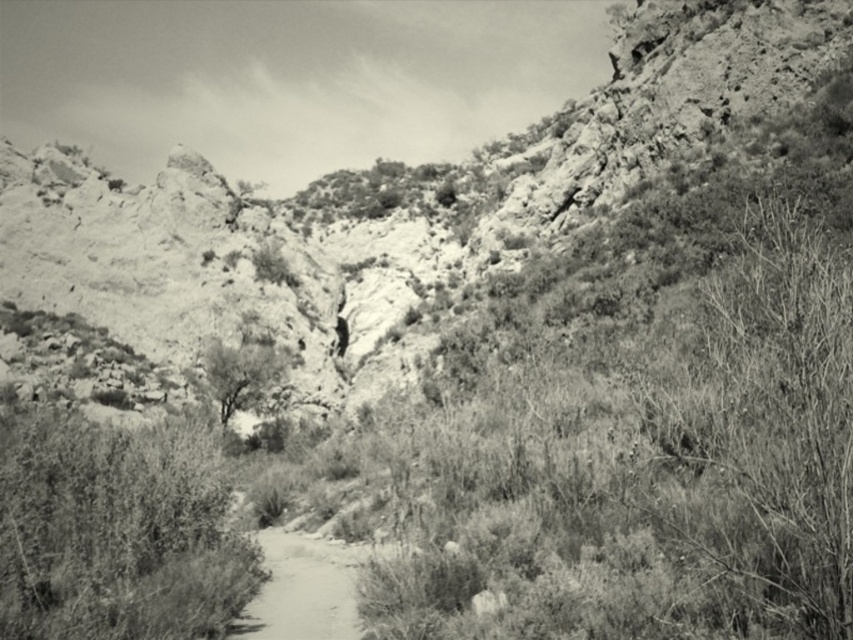
Does thorny bush at right have a lesser height compared to smooth dirt path at center?

In fact, thorny bush at right may be taller than smooth dirt path at center.

Can you confirm if thorny bush at right is positioned to the right of smooth dirt path at center?

Yes, thorny bush at right is to the right of smooth dirt path at center.

Image resolution: width=853 pixels, height=640 pixels. I want to click on thorny bush at right, so click(764, 426).

The height and width of the screenshot is (640, 853). I want to click on thorny bush at right, so click(x=764, y=426).

Consider the image. Who is positioned more to the left, thorny bush at right or grainy gray tree at center?

Positioned to the left is grainy gray tree at center.

Looking at this image, is thorny bush at right wider than grainy gray tree at center?

Indeed, thorny bush at right has a greater width compared to grainy gray tree at center.

Does point (788, 392) come farther from viewer compared to point (276, 356)?

No, (788, 392) is closer to viewer.

At what (x,y) coordinates should I click in order to perform the action: click on thorny bush at right. Please return your answer as a coordinate pair (x, y). This screenshot has height=640, width=853. Looking at the image, I should click on (764, 426).

Between rugged stone mountain at center and smooth dirt path at center, which one has more height?

rugged stone mountain at center

Is the position of rugged stone mountain at center more distant than that of smooth dirt path at center?

Yes, rugged stone mountain at center is further from the viewer.

This screenshot has width=853, height=640. Describe the element at coordinates (387, 209) in the screenshot. I see `rugged stone mountain at center` at that location.

Where is `rugged stone mountain at center`? rugged stone mountain at center is located at coordinates (387, 209).